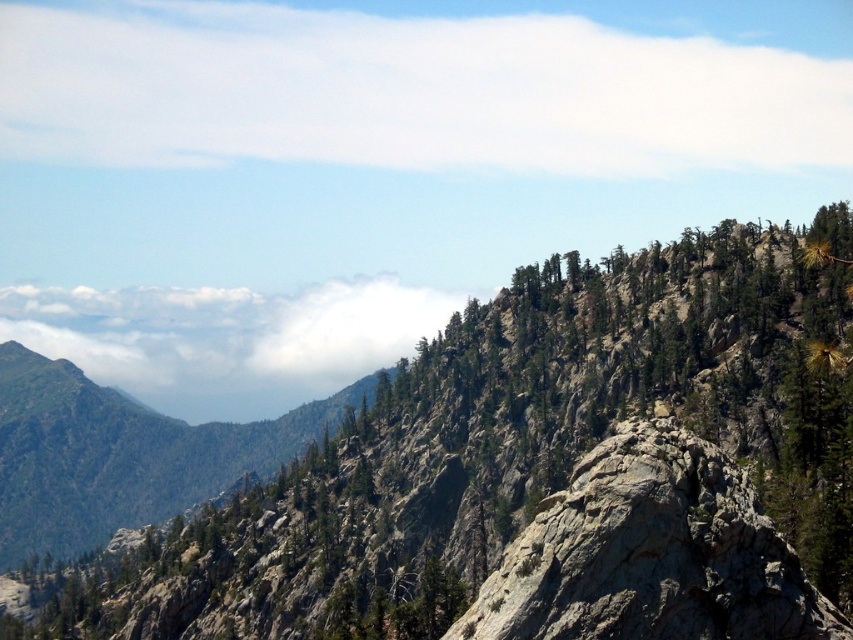
Based on the photo, you are an airplane pilot flying over the rugged mountainous landscape. You notice the white fluffy cloud at upper left and the green rocky mountain at center. Which one is lower in the sky?

The white fluffy cloud at upper left has a lesser height compared to the green rocky mountain at center, so the white fluffy cloud at upper left is lower in the sky.

You are a hiker who wants to take a photo of the white fluffy cloud at upper center. Where should you position yourself to capture it in the best possible way?

The white fluffy cloud at upper center is located at coordinates point (404, 92), so you should position yourself at a point where you can frame the cloud in the center of your photo to capture it best.